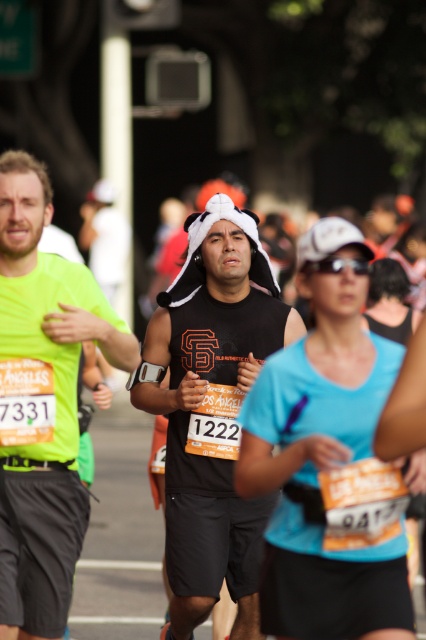
What is the 2D coordinate of the black matte tank top at center?

The black matte tank top at center is located at the 2D coordinate point of (212, 410).

Based on the scene description, which runner is taller, the one wearing the black matte tank top at center or the one in the neon green fabric shirt at left?

The black matte tank top at center is much taller than the neon green fabric shirt at left according to the description.